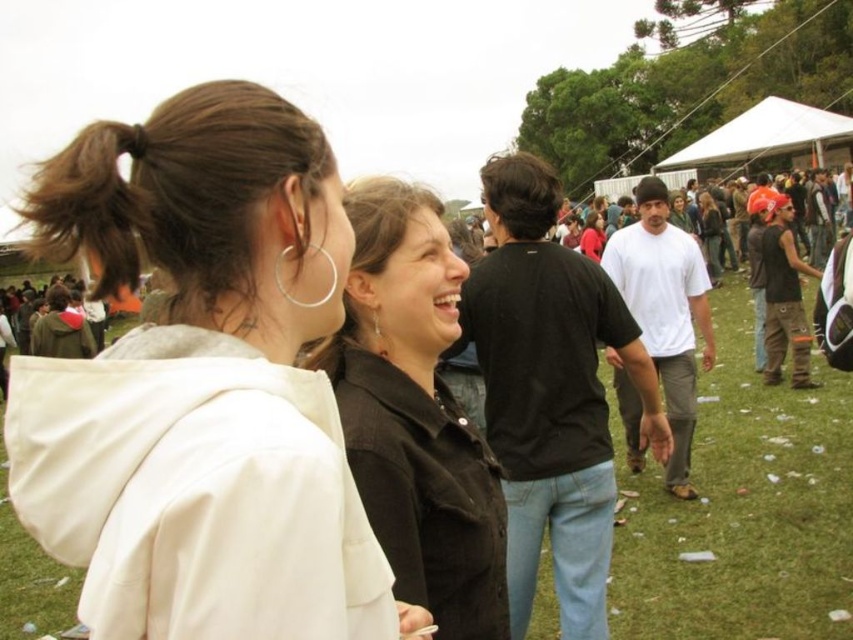
Question: Does white matte jacket at upper left appear under black matte shirt at center?

Choices:
 (A) yes
 (B) no

Answer: (B)

Question: Can you confirm if white matte jacket at upper left is positioned to the left of black matte shirt at center?

Choices:
 (A) yes
 (B) no

Answer: (A)

Question: Among these points, which one is nearest to the camera?

Choices:
 (A) (167, 122)
 (B) (460, 547)

Answer: (A)

Question: Does white matte jacket at upper left appear over black matte shirt at center?

Choices:
 (A) no
 (B) yes

Answer: (B)